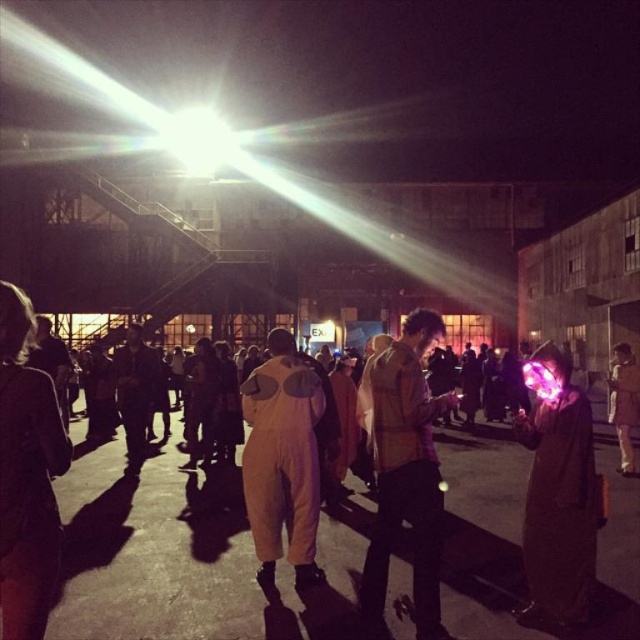
Question: Which of these objects is positioned farthest from the light brown jumpsuit at center?

Choices:
 (A) light brown leather jacket at lower left
 (B) light brown leather jacket at center
 (C) matte purple orb at right

Answer: (A)

Question: Can you confirm if light brown leather jacket at lower left is smaller than dark fabric jacket at center?

Choices:
 (A) no
 (B) yes

Answer: (B)

Question: Which of the following is the closest to the observer?

Choices:
 (A) click(x=278, y=499)
 (B) click(x=627, y=470)
 (C) click(x=589, y=461)

Answer: (C)

Question: In this image, where is light brown jumpsuit at center located relative to light brown fabric jacket at center?

Choices:
 (A) below
 (B) above

Answer: (B)

Question: Which of the following is the closest to the observer?

Choices:
 (A) (556, 467)
 (B) (310, 557)

Answer: (A)

Question: Does light brown leather jacket at center have a smaller size compared to light brown leather jacket at lower left?

Choices:
 (A) no
 (B) yes

Answer: (A)